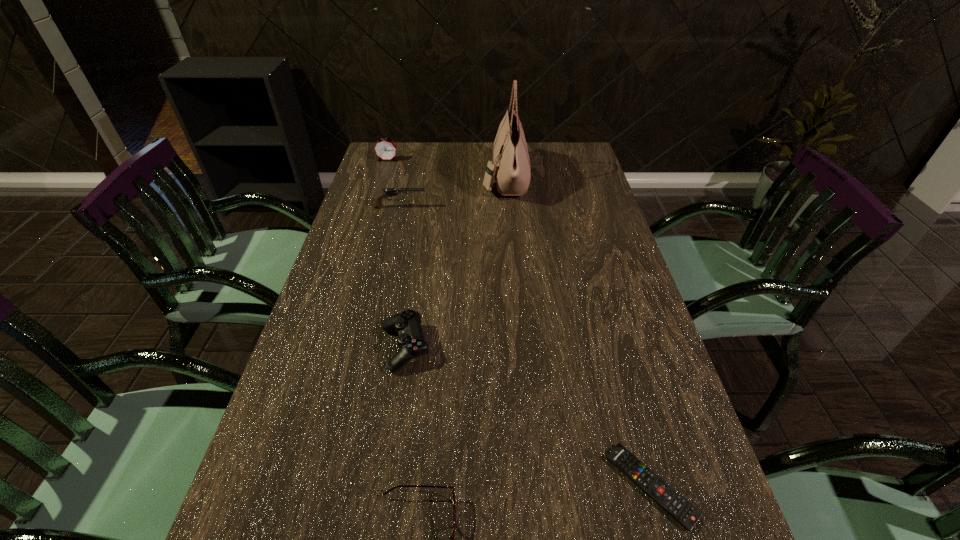
You are a GUI agent. You are given a task and a screenshot of the screen. Output one action in this format:
    pyautogui.click(x=<x>, y=<y>)
    Task: Click on the vacant space that's between the remote control and the second tallest object
    Image resolution: width=960 pixels, height=540 pixels.
    Given the screenshot: What is the action you would take?
    pyautogui.click(x=519, y=323)

Locate an element on the screen. Image resolution: width=960 pixels, height=540 pixels. empty space that is in between the gun and the control is located at coordinates (402, 278).

Choose which object is the fourth nearest neighbor to the tallest object. Please provide its 2D coordinates. Your answer should be formatted as a tuple, i.e. [(x, y)], where the tuple contains the x and y coordinates of a point satisfying the conditions above.

[(687, 515)]

Identify which object is the fifth nearest to the spectacles. Please provide its 2D coordinates. Your answer should be formatted as a tuple, i.e. [(x, y)], where the tuple contains the x and y coordinates of a point satisfying the conditions above.

[(385, 149)]

You are a GUI agent. You are given a task and a screenshot of the screen. Output one action in this format:
    pyautogui.click(x=<x>, y=<y>)
    Task: Click on the vacant space that satisfies the following two spatial constraints: 1. on the clock face of the alarm clock; 2. on the right side of the control
    Image resolution: width=960 pixels, height=540 pixels.
    Given the screenshot: What is the action you would take?
    pyautogui.click(x=328, y=348)

You are a GUI agent. You are given a task and a screenshot of the screen. Output one action in this format:
    pyautogui.click(x=<x>, y=<y>)
    Task: Click on the vacant space that satisfies the following two spatial constraints: 1. aiming along the barrel of the gun; 2. on the left side of the remote control
    
    Given the screenshot: What is the action you would take?
    pyautogui.click(x=336, y=486)

Find the location of a particular element. The image size is (960, 540). vacant space that satisfies the following two spatial constraints: 1. on the clock face of the second tallest object; 2. on the left side of the fourth farthest object is located at coordinates (328, 348).

Find the location of `blank area in the image that satisfies the following two spatial constraints: 1. on the side of the fifth object from left to right with the attached pouch; 2. on the right side of the rightmost object`. blank area in the image that satisfies the following two spatial constraints: 1. on the side of the fifth object from left to right with the attached pouch; 2. on the right side of the rightmost object is located at coordinates (530, 486).

In order to click on free region that satisfies the following two spatial constraints: 1. on the clock face of the rightmost object; 2. on the left side of the alarm clock in this screenshot , I will do `click(285, 486)`.